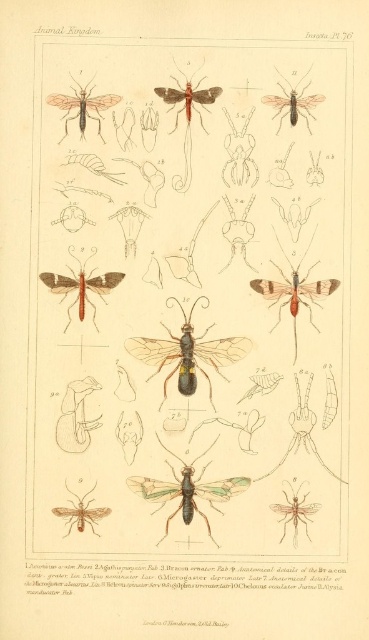
How far apart are the translucent beige moth at upper left and the metallic green beetle at lower right?

The translucent beige moth at upper left and the metallic green beetle at lower right are 4.59 feet apart.